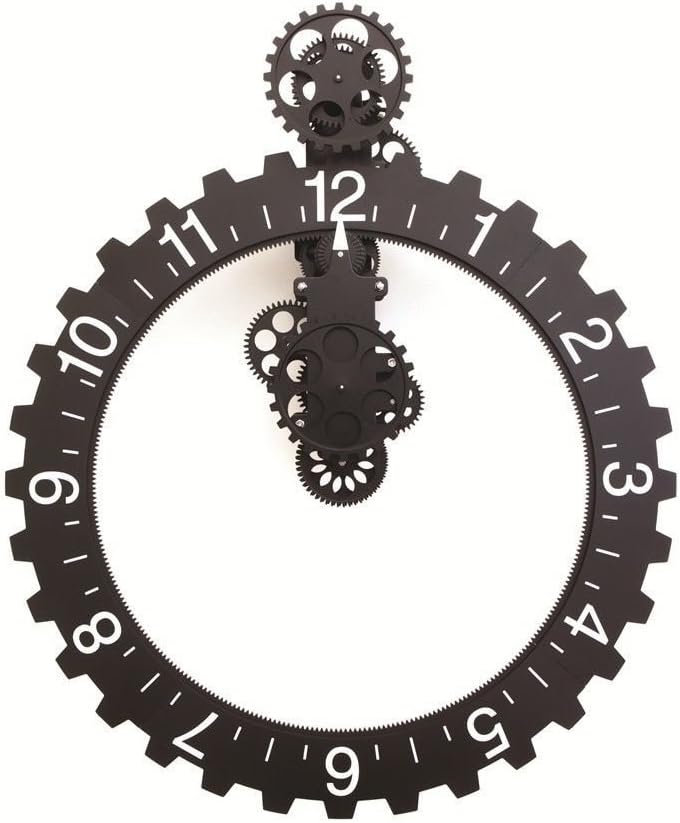
Find the location of `background bottom right of clock`. background bottom right of clock is located at coordinates (617, 754).